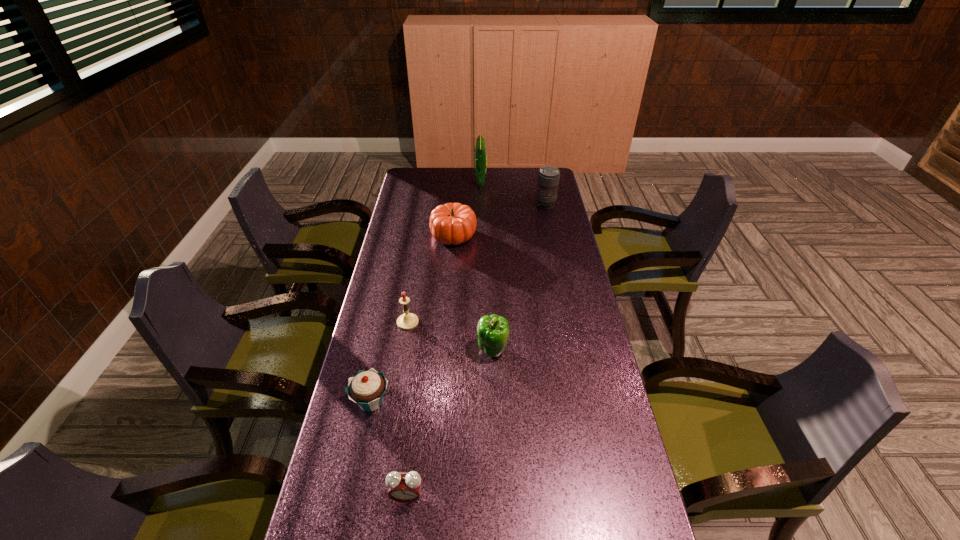
Locate an element on the screen. This screenshot has height=540, width=960. the farthest object is located at coordinates (480, 150).

The width and height of the screenshot is (960, 540). Identify the location of the tallest object. (480, 150).

At what (x,y) coordinates should I click in order to perform the action: click on the second farthest object. Please return your answer as a coordinate pair (x, y). This screenshot has height=540, width=960. Looking at the image, I should click on (548, 177).

Where is `telephoto lens`? The image size is (960, 540). telephoto lens is located at coordinates coord(548,177).

This screenshot has height=540, width=960. Identify the location of bell pepper. (493, 331).

The image size is (960, 540). Identify the location of pumpkin. (453, 223).

I want to click on the fourth farthest object, so click(407, 321).

Find the location of `the second nearest object`. the second nearest object is located at coordinates (367, 388).

Identify the location of alarm clock. (404, 487).

Locate an element on the screen. The image size is (960, 540). vacant space located 0.080m on the front-facing side of the farthest object is located at coordinates (x=459, y=182).